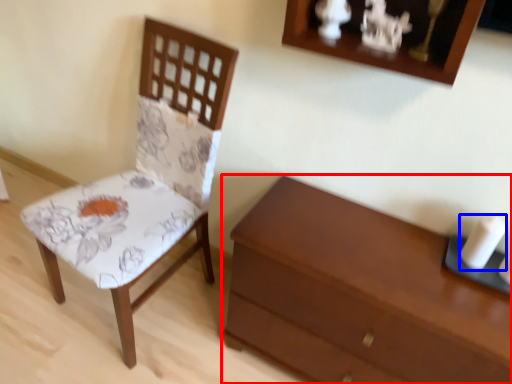
Question: Which object is further to the camera taking this photo, chest of drawers (highlighted by a red box) or candle (highlighted by a blue box)?

Choices:
 (A) chest of drawers
 (B) candle

Answer: (B)